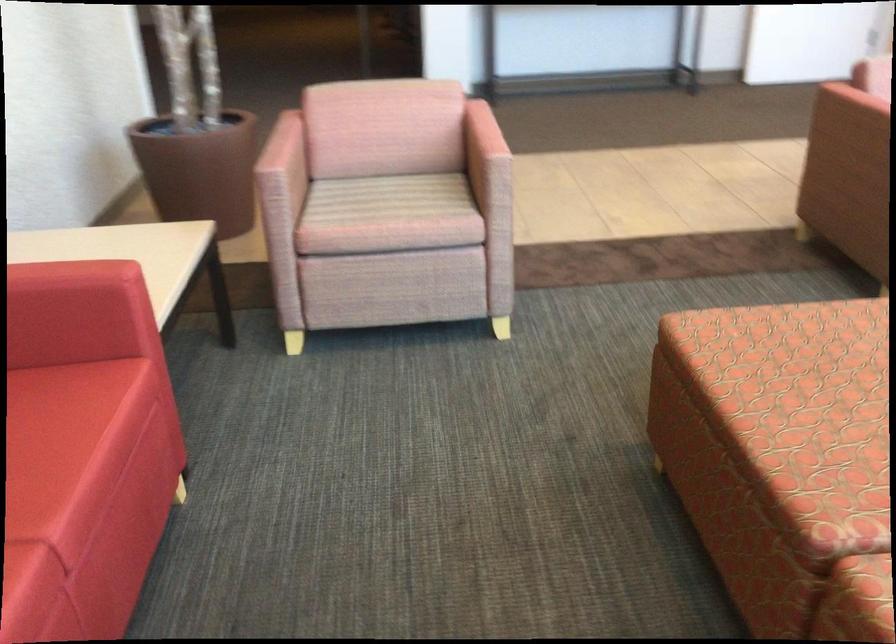
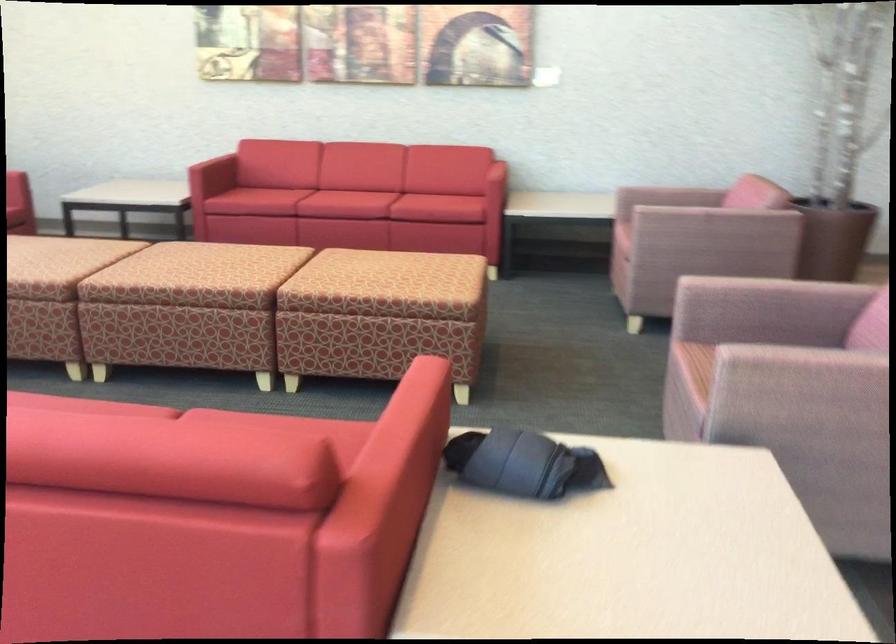
Question: I am providing you with two images of the same scene from different viewpoints. After the viewpoint changes to image2, which objects are now occluded?

Choices:
 (A) kitchen faucet handle
 (B) rolled up clothing
 (C) pink chair armrest
 (D) pink chair sitting surface

Answer: (C)